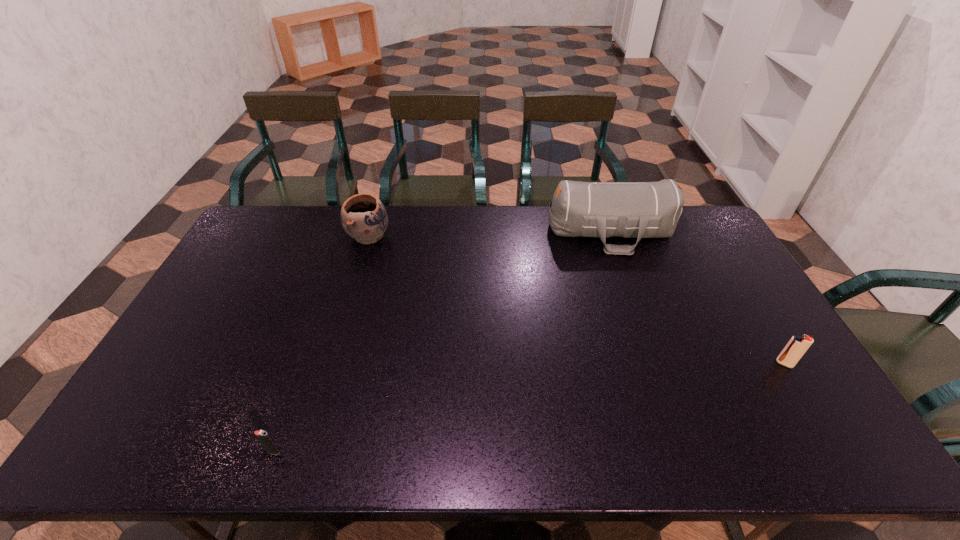
Where is `empty location between the duffel bag and the third shortest object`? The image size is (960, 540). empty location between the duffel bag and the third shortest object is located at coordinates (490, 234).

Find the location of a particular element. Image resolution: width=960 pixels, height=540 pixels. object that is the third nearest to the third object from left to right is located at coordinates (264, 438).

Identify which object is located as the third nearest to the rightmost object. Please provide its 2D coordinates. Your answer should be formatted as a tuple, i.e. [(x, y)], where the tuple contains the x and y coordinates of a point satisfying the conditions above.

[(264, 438)]

Locate an element on the screen. free space that satisfies the following two spatial constraints: 1. on the back side of the tallest object; 2. on the left side of the third shortest object is located at coordinates (370, 232).

What are the coordinates of `vacant space that satisfies the following two spatial constraints: 1. on the front side of the rightmost object; 2. on the left side of the tallest object` in the screenshot? It's located at (659, 363).

Find the location of a particular element. This screenshot has height=540, width=960. vacant space that satisfies the following two spatial constraints: 1. on the front side of the tallest object; 2. on the right side of the second shortest object is located at coordinates (659, 363).

Where is `free region that satisfies the following two spatial constraints: 1. on the back side of the nearest object; 2. on the left side of the duffel bag`? Image resolution: width=960 pixels, height=540 pixels. free region that satisfies the following two spatial constraints: 1. on the back side of the nearest object; 2. on the left side of the duffel bag is located at coordinates (350, 232).